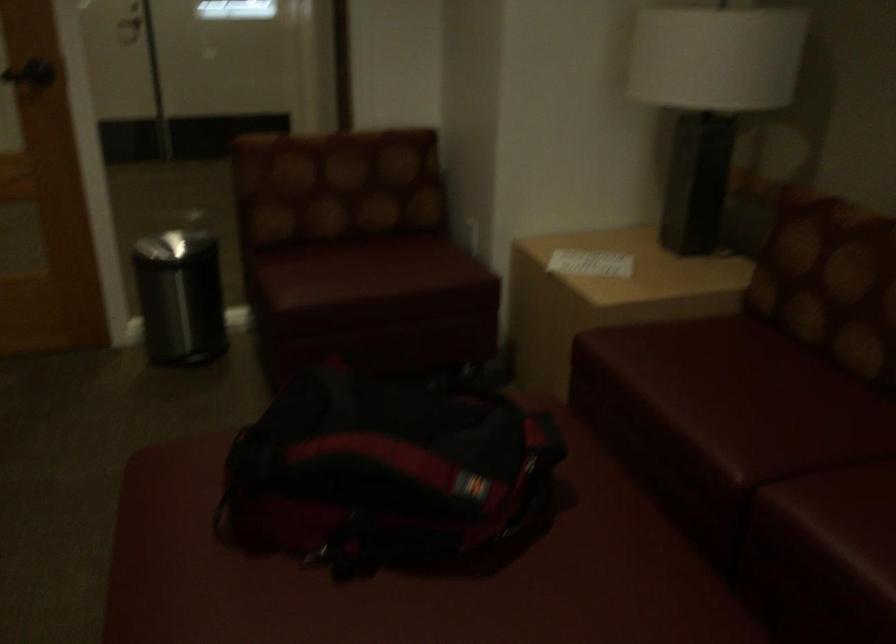
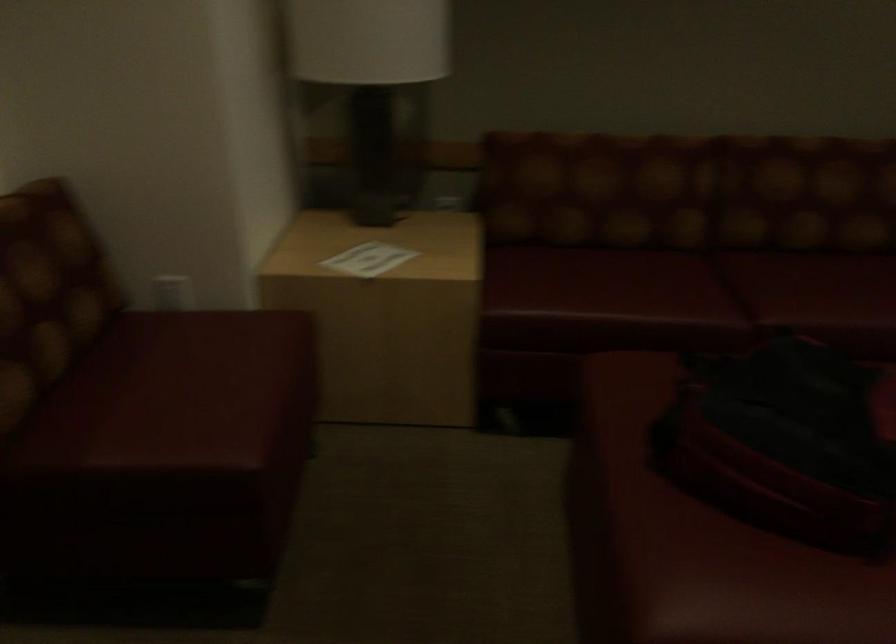
In the second image, find the point that corresponds to point 588,263 in the first image.

(367, 259)